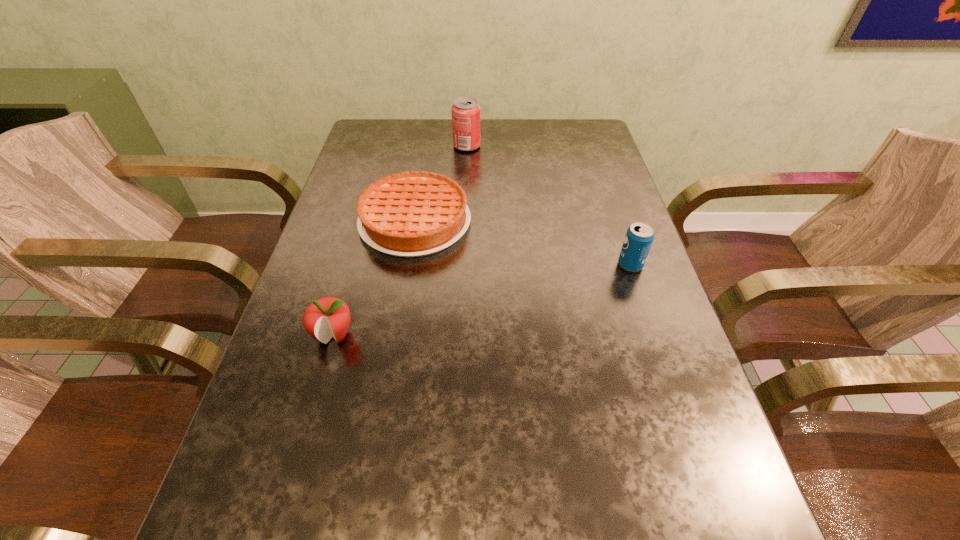
You are a GUI agent. You are given a task and a screenshot of the screen. Output one action in this format:
    pyautogui.click(x=<x>, y=<y>)
    Task: Click on the object present at the far edge
    The height and width of the screenshot is (540, 960).
    Given the screenshot: What is the action you would take?
    tap(466, 111)

You are a GUI agent. You are given a task and a screenshot of the screen. Output one action in this format:
    pyautogui.click(x=<x>, y=<y>)
    Task: Click on the apple positioned at the left edge
    Image resolution: width=960 pixels, height=540 pixels.
    Given the screenshot: What is the action you would take?
    pyautogui.click(x=328, y=317)

What are the coordinates of `pie situated at the left edge` in the screenshot? It's located at (410, 214).

Find the location of a particular element. Image resolution: width=960 pixels, height=540 pixels. object that is positioned at the right edge is located at coordinates (639, 236).

In the image, there is a desktop. Where is `vacant area at the far edge`? The width and height of the screenshot is (960, 540). vacant area at the far edge is located at coordinates (420, 144).

Where is `free space at the left edge of the desktop`? The image size is (960, 540). free space at the left edge of the desktop is located at coordinates (369, 273).

Identify the location of free space at the right edge. (717, 463).

Image resolution: width=960 pixels, height=540 pixels. In the image, there is a desktop. Find the location of `vacant space at the far left corner`. vacant space at the far left corner is located at coordinates (389, 124).

What are the coordinates of `vacant space at the far right corner of the desktop` in the screenshot? It's located at (551, 120).

The height and width of the screenshot is (540, 960). What are the coordinates of `unoccupied area between the farther soda can and the right soda can` in the screenshot? It's located at (548, 205).